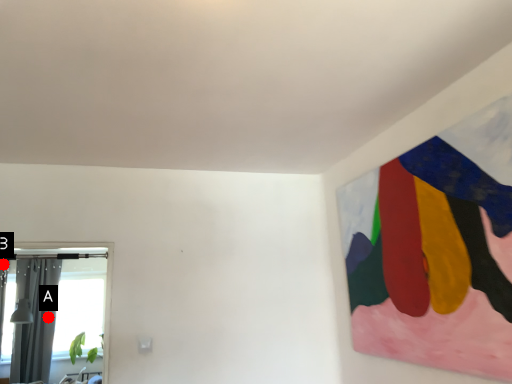
Question: Two points are circled on the image, labeled by A and B beside each circle. Which point appears farthest from the camera in this image?

Choices:
 (A) A is further
 (B) B is further

Answer: (A)